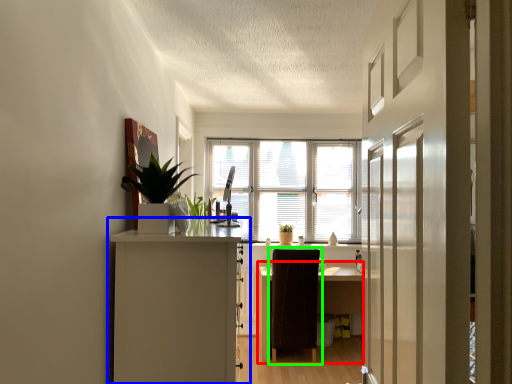
Question: Based on their relative distances, which object is farther from desk (highlighted by a red box)? Choose from cabinetry (highlighted by a blue box) and chair (highlighted by a green box).

Choices:
 (A) cabinetry
 (B) chair

Answer: (A)